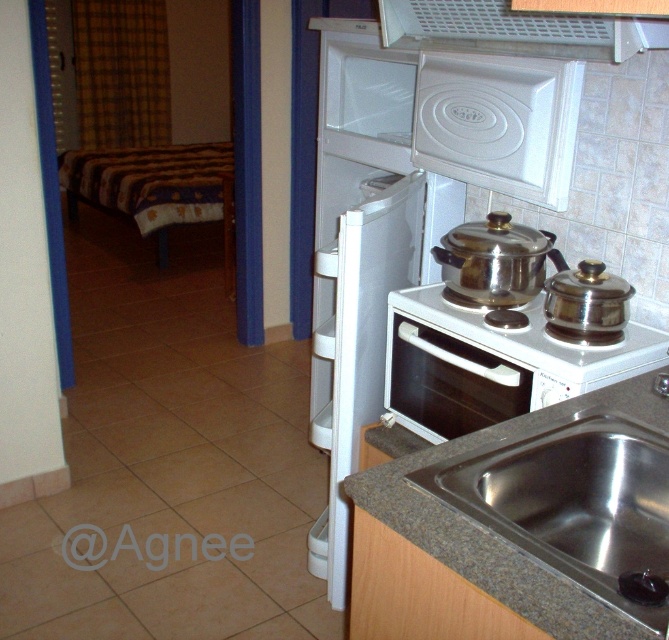
In the scene shown: You are a delivery person who needs to place a package on the countertop near the stainless steel stove at center. Where exactly should you place it?

The stainless steel stove at center is located at point (405, 208), so you should place the package near those coordinates on the countertop.

You are standing in the kitchen and need to reach a point marked at coordinates point (x=369, y=54). Can you estimate whether this point is within arm reach, considering an average arm length of 2.5 feet?

The distance between you and point (x=369, y=54) is 7.24 feet, which is much longer than the average arm length of 2.5 feet. Therefore, the point is out of arm reach.

From the picture: You are a kitchen designer planning to replace the appliances in the kitchen. You have a space that can accommodate the white glossy gas stove at center but not the stainless steel stove at center. Which one should you choose to fit the space?

The stainless steel stove at center is bigger than the white glossy gas stove at center, so you should choose the white glossy gas stove at center to fit the space.